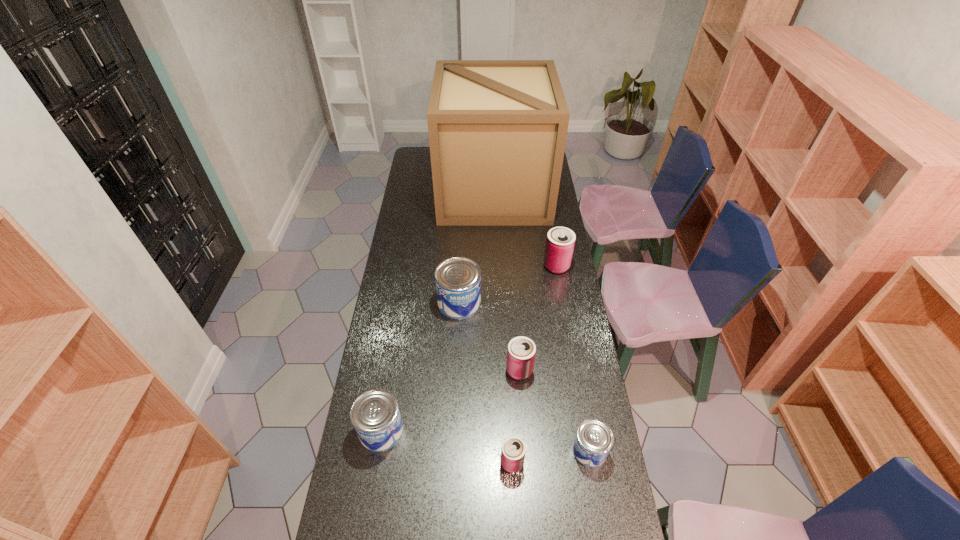
Identify the location of vacant space located 0.170m on the front label of the rightmost blue can. (518, 450).

Locate an element on the screen. free space located 0.320m on the front label of the rightmost blue can is located at coordinates (471, 450).

Image resolution: width=960 pixels, height=540 pixels. Find the location of `free location located 0.170m on the front label of the rightmost blue can`. free location located 0.170m on the front label of the rightmost blue can is located at coordinates (518, 450).

At what (x,y) coordinates should I click in order to perform the action: click on object at the far edge. Please return your answer as a coordinate pair (x, y). The image size is (960, 540). Looking at the image, I should click on (497, 129).

Locate an element on the screen. The height and width of the screenshot is (540, 960). object at the left edge is located at coordinates (375, 415).

You are a GUI agent. You are given a task and a screenshot of the screen. Output one action in this format:
    pyautogui.click(x=<x>, y=<y>)
    Task: Click on the box that is at the right edge
    The image size is (960, 540).
    Given the screenshot: What is the action you would take?
    pyautogui.click(x=497, y=129)

In order to click on object that is at the far right corner in this screenshot , I will do `click(497, 129)`.

This screenshot has height=540, width=960. In order to click on vacant space at the left edge in this screenshot , I will do `click(407, 210)`.

Image resolution: width=960 pixels, height=540 pixels. I want to click on vacant space at the right edge of the desktop, so click(x=582, y=326).

Identify the location of vacant space that is in between the tallest object and the leftmost can. (438, 311).